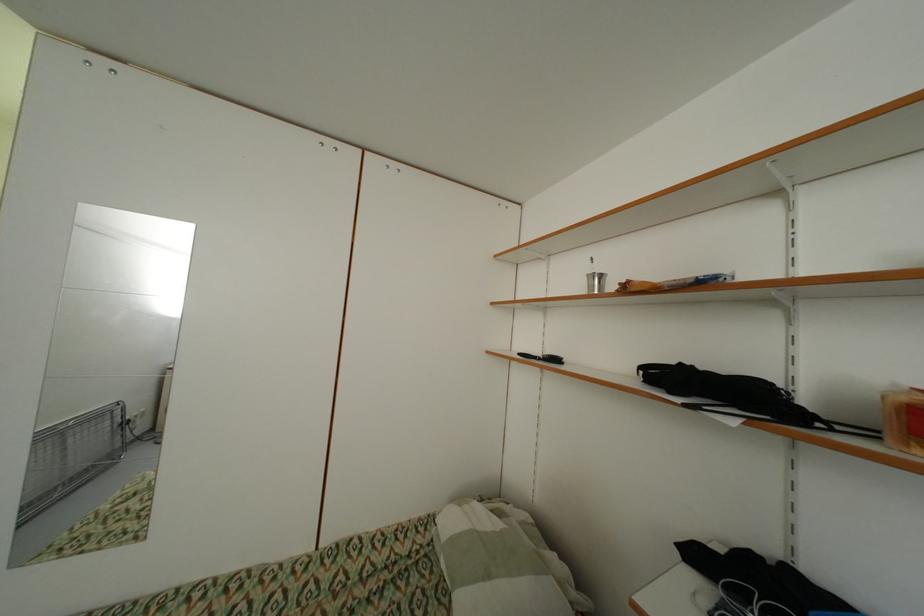
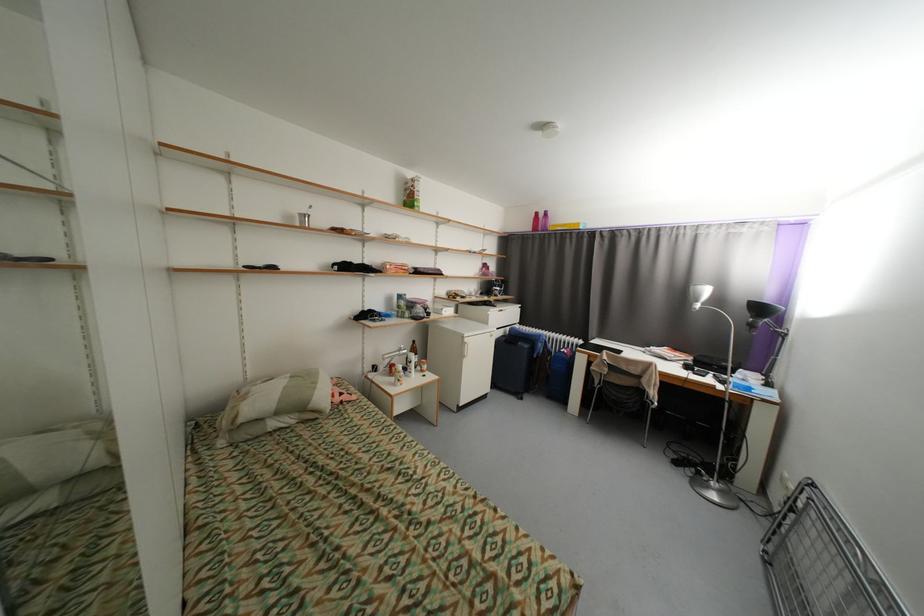
Locate, in the second image, the point that corresponds to pixel 494 577 in the first image.

(322, 384)